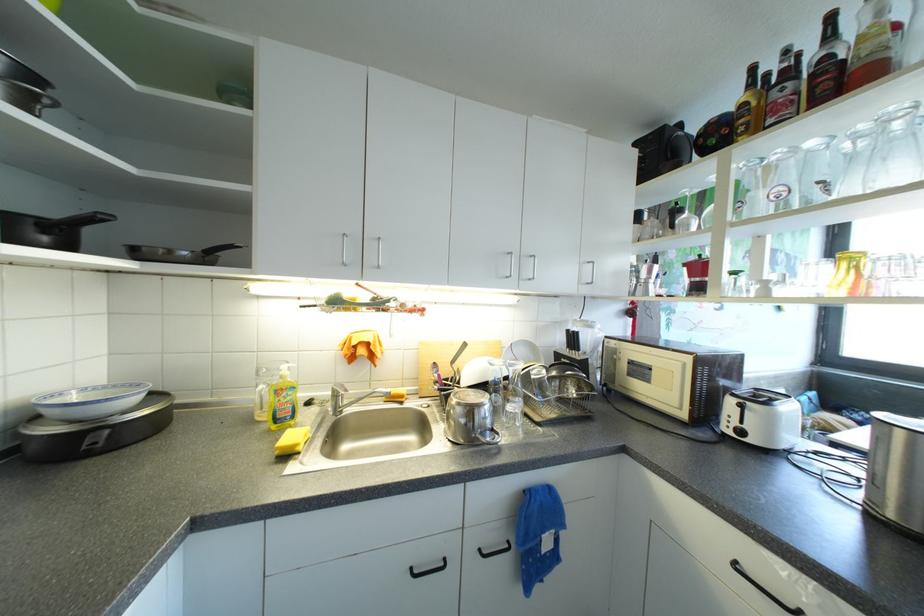
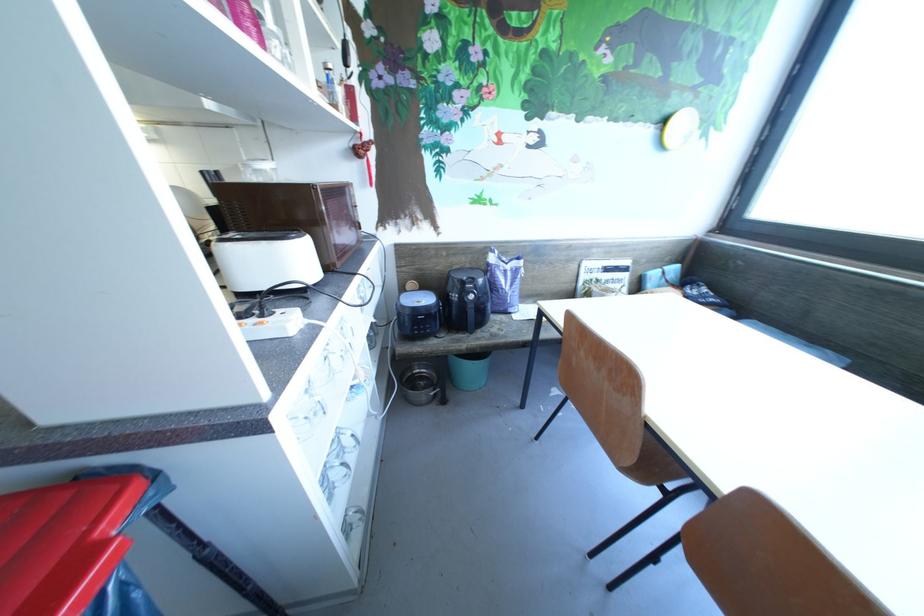
Question: Which direction would the cameraman need to move to produce the second image? Reply with the corresponding letter.

Choices:
 (A) Left
 (B) Right
 (C) Forward
 (D) Backward

Answer: (B)